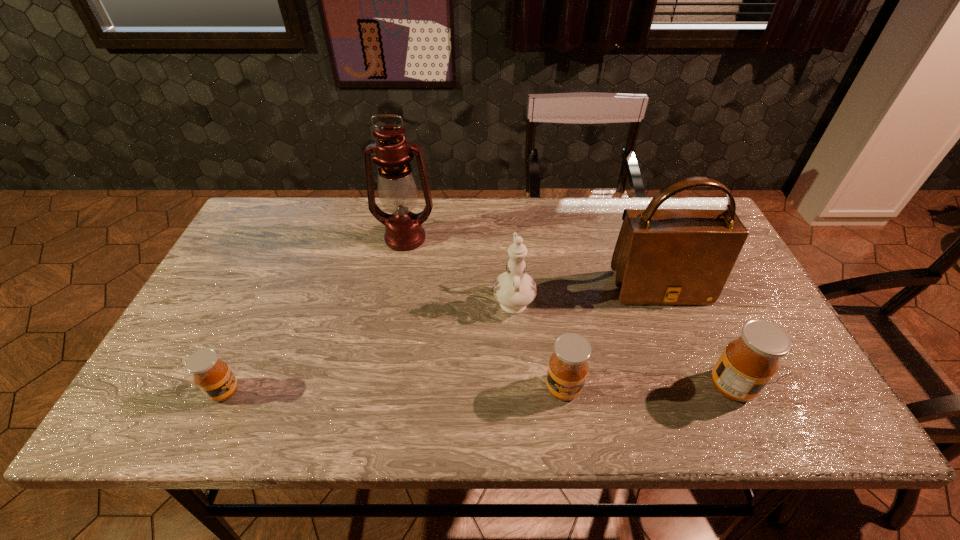
Please point a spot to place another honey for symmetrical spacing. Please provide its 2D coordinates. Your answer should be formatted as a tuple, i.e. [(x, y)], where the tuple contains the x and y coordinates of a point satisfying the conditions above.

[(395, 390)]